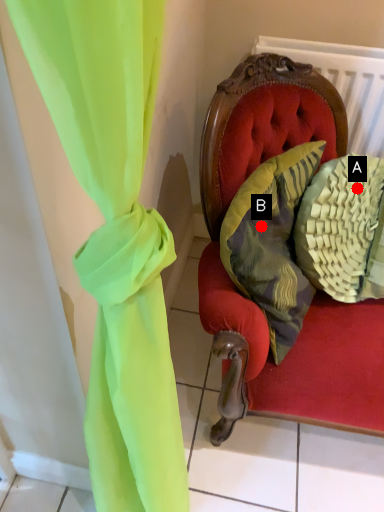
Question: Two points are circled on the image, labeled by A and B beside each circle. Which point is closer to the camera?

Choices:
 (A) A is closer
 (B) B is closer

Answer: (B)